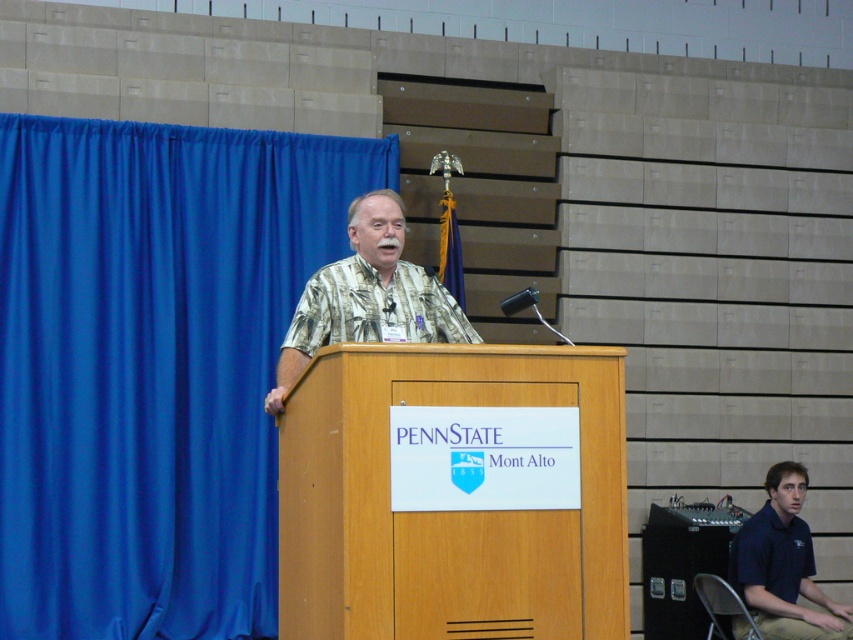
You are attending a lecture at Penn State Mont Alto and notice a specific point marked at coordinates [152,364]. Based on the scene description, where is this point located?

The point is located on the blue fabric curtain at left.